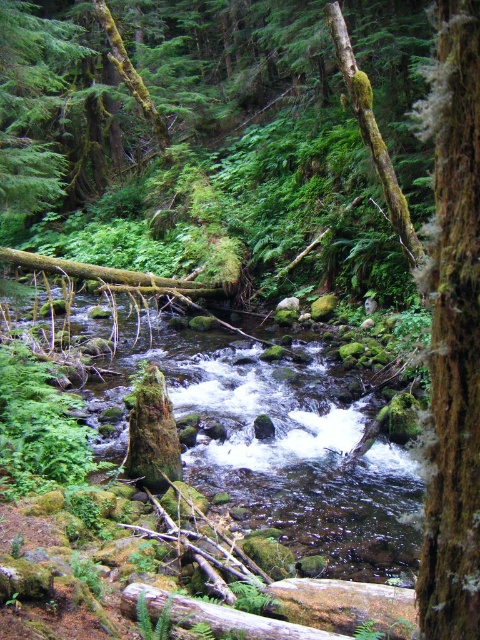
Which is more to the right, clear water at center or brown rough bark tree trunk at right?

brown rough bark tree trunk at right is more to the right.

Is clear water at center positioned before brown rough bark tree trunk at right?

No, clear water at center is behind brown rough bark tree trunk at right.

Image resolution: width=480 pixels, height=640 pixels. What do you see at coordinates (290, 452) in the screenshot?
I see `clear water at center` at bounding box center [290, 452].

The width and height of the screenshot is (480, 640). What are the coordinates of `clear water at center` in the screenshot? It's located at (x=290, y=452).